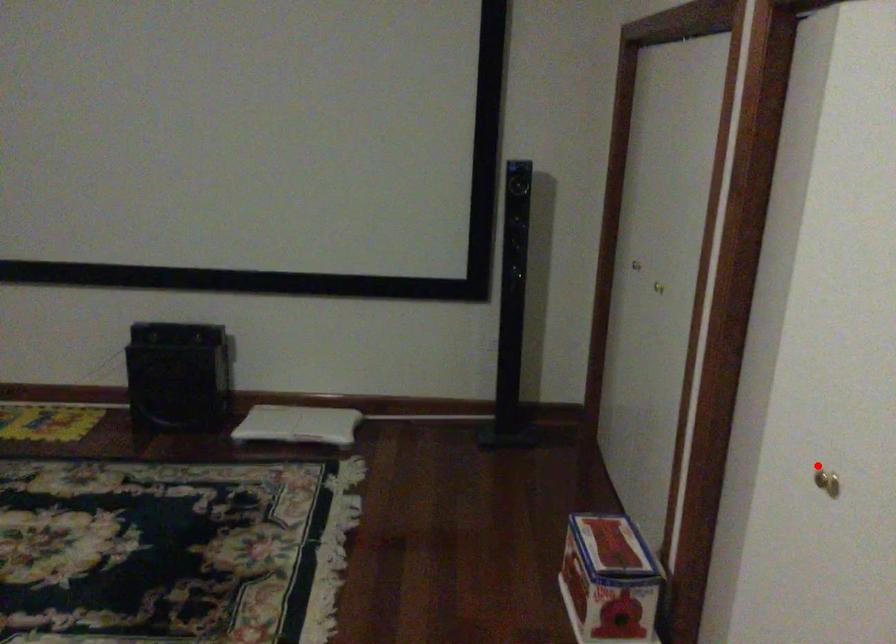
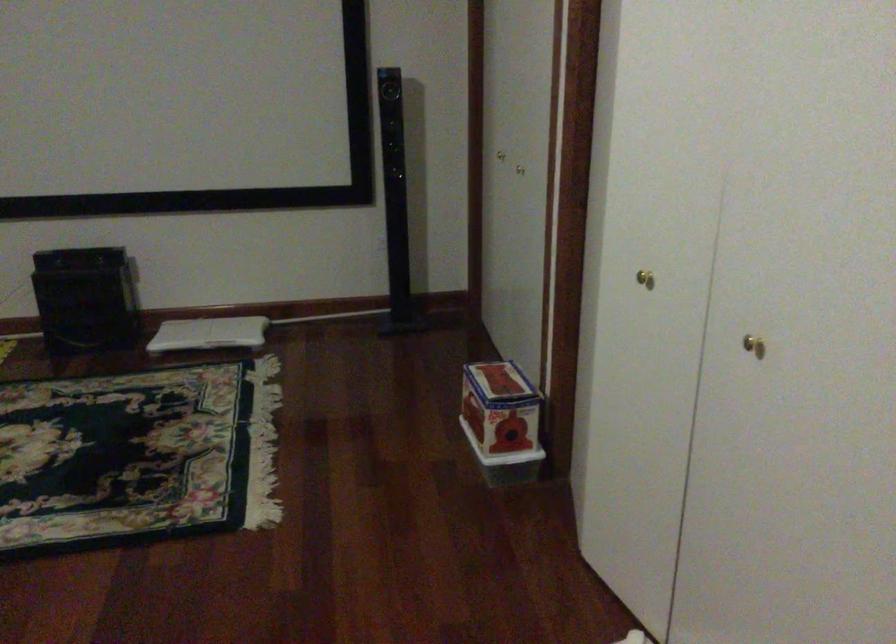
Question: I am providing you with two images of the same scene from different viewpoints. A red point is shown in image1. For the corresponding object point in image2, is it positioned nearer or farther from the camera?

Choices:
 (A) Nearer
 (B) Farther

Answer: (B)